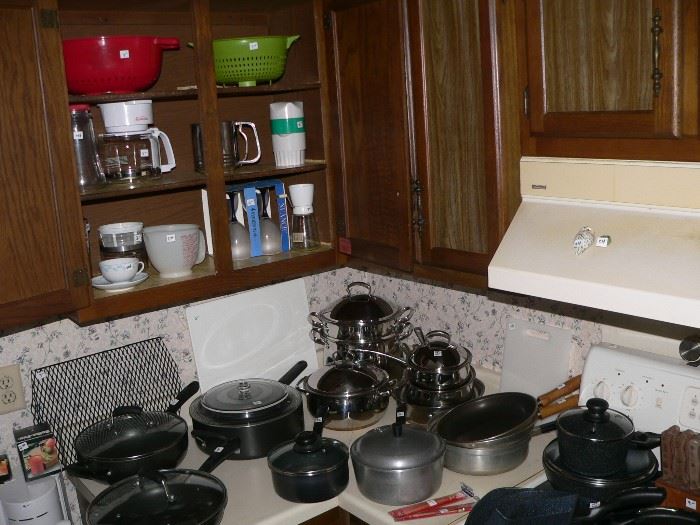
Locate an element on the screen. vent is located at coordinates 656,273.